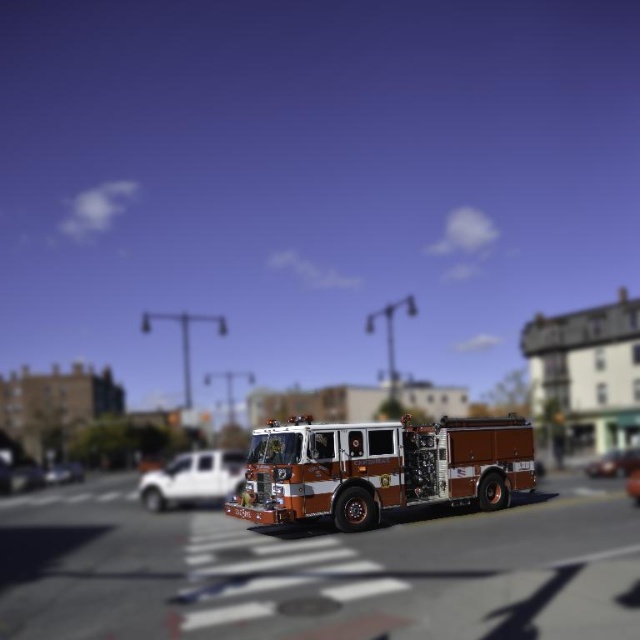
You are standing at the center of the image and want to locate the shiny red fire truck at center. What are its coordinates?

The shiny red fire truck at center is located at coordinates point [380,468].

You are a photographer trying to capture the miniature fire truck in the scene. You notice two points marked in the image. Which point, point [208,481] or point [634,481], is closer to your camera lens?

Point [208,481] is closer to the camera than point [634,481].

You are standing at the intersection looking at the fire truck. There is a shiny silver car at center. Where is the point located at coordinates point (608, 465)?

The point (608, 465) is located on the shiny silver car at center.